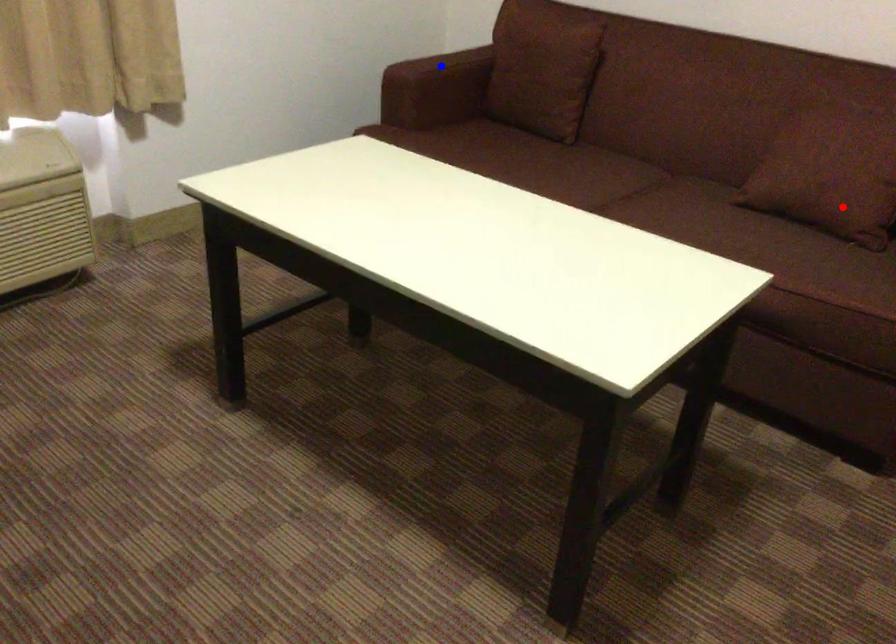
Question: Which of the two points in the image is closer to the camera?

Choices:
 (A) Blue point is closer.
 (B) Red point is closer.

Answer: (B)